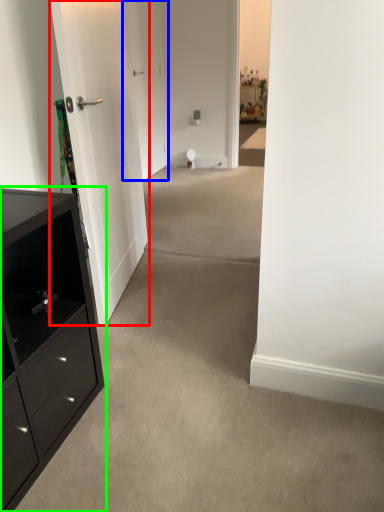
Question: Estimate the real-world distances between objects in this image. Which object is closer to door (highlighted by a red box), door (highlighted by a blue box) or chest of drawers (highlighted by a green box)?

Choices:
 (A) door
 (B) chest of drawers

Answer: (B)